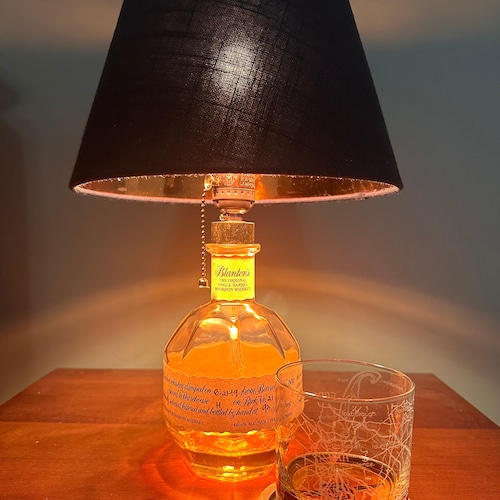
The image size is (500, 500). What are the coordinates of `coaster` in the screenshot? It's located at point(266,493).